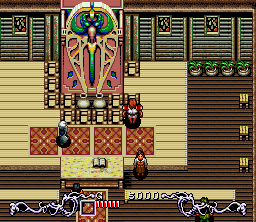
Find the location of a particular element. jar is located at coordinates (97, 107).